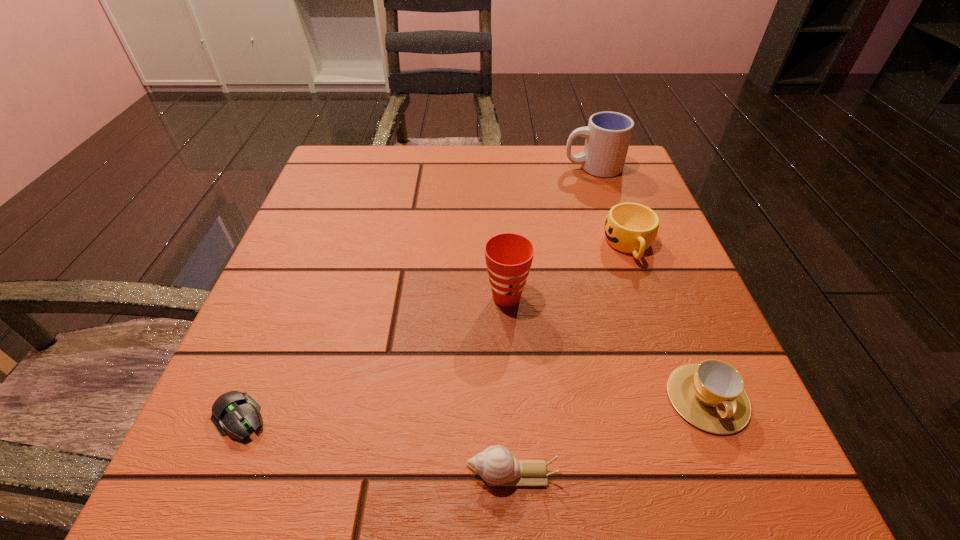
Where is `free space between the fourth nearest object and the nearest object`? free space between the fourth nearest object and the nearest object is located at coordinates (509, 386).

At what (x,y) coordinates should I click in order to perform the action: click on vacant space that's between the nearest cup and the third farthest object. Please return your answer as a coordinate pair (x, y). The width and height of the screenshot is (960, 540). Looking at the image, I should click on (607, 348).

Identify which object is the second nearest to the shortest cup. Please provide its 2D coordinates. Your answer should be formatted as a tuple, i.e. [(x, y)], where the tuple contains the x and y coordinates of a point satisfying the conditions above.

[(508, 256)]

Point out which object is positioned as the nearest to the second nearest cup. Please provide its 2D coordinates. Your answer should be formatted as a tuple, i.e. [(x, y)], where the tuple contains the x and y coordinates of a point satisfying the conditions above.

[(631, 228)]

Select which cup is the fourth closest to the leftmost object. Please provide its 2D coordinates. Your answer should be formatted as a tuple, i.e. [(x, y)], where the tuple contains the x and y coordinates of a point satisfying the conditions above.

[(608, 134)]

You are a GUI agent. You are given a task and a screenshot of the screen. Output one action in this format:
    pyautogui.click(x=<x>, y=<y>)
    Task: Click on the cup that is the closest one to the leftmost object
    The image size is (960, 540).
    Given the screenshot: What is the action you would take?
    pyautogui.click(x=508, y=256)

Where is `vacant space that satisfies the following two spatial constraints: 1. with the handle on the side of the shortest cup; 2. on the shell of the nearest object`? The height and width of the screenshot is (540, 960). vacant space that satisfies the following two spatial constraints: 1. with the handle on the side of the shortest cup; 2. on the shell of the nearest object is located at coordinates (738, 474).

Locate an element on the screen. This screenshot has height=540, width=960. free space that satisfies the following two spatial constraints: 1. with the handle on the side of the farthest object; 2. on the left side of the second farthest object is located at coordinates (619, 245).